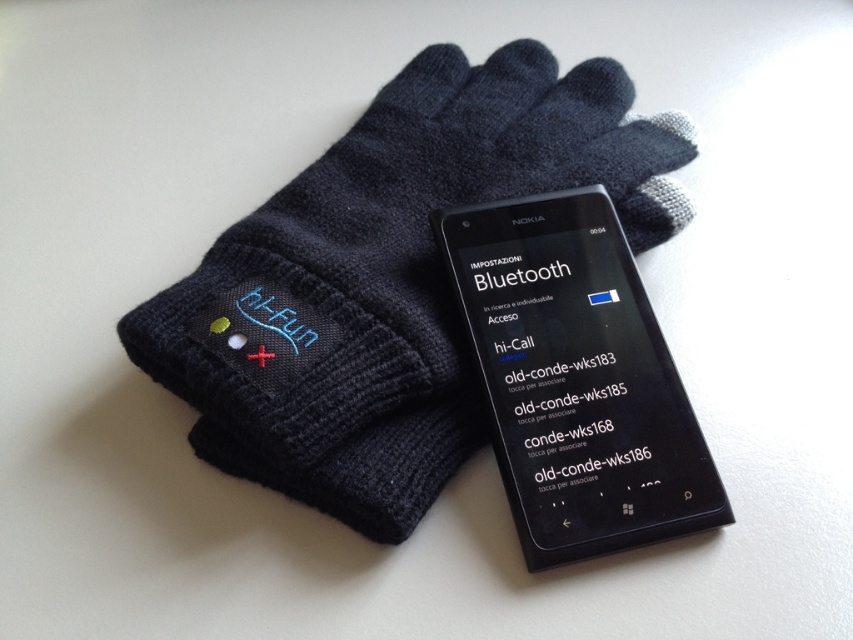
Question: Which point is farther to the camera?

Choices:
 (A) black knitted glove at upper center
 (B) black matte smartphone at center

Answer: (B)

Question: Is black knitted glove at upper center below black matte smartphone at center?

Choices:
 (A) yes
 (B) no

Answer: (B)

Question: Which object appears closest to the camera in this image?

Choices:
 (A) black matte smartphone at center
 (B) black knitted glove at upper center

Answer: (B)

Question: Can you confirm if black knitted glove at upper center is smaller than black matte smartphone at center?

Choices:
 (A) no
 (B) yes

Answer: (A)

Question: Among these points, which one is nearest to the camera?

Choices:
 (A) (495, 228)
 (B) (396, 88)

Answer: (A)

Question: Where is black knitted glove at upper center located in relation to black matte smartphone at center in the image?

Choices:
 (A) below
 (B) above

Answer: (B)